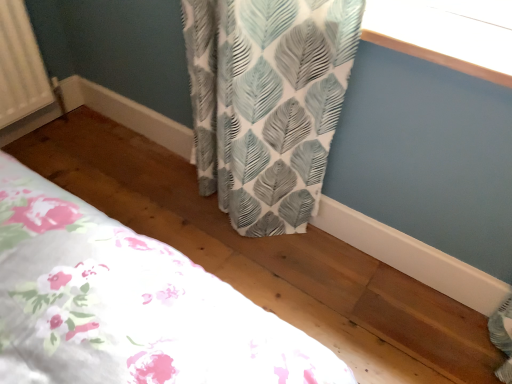
Question: From their relative heights in the image, would you say floral fabric bed at lower left is taller or shorter than white leaf-patterned curtain at upper right?

Choices:
 (A) short
 (B) tall

Answer: (B)

Question: Based on their positions, is floral fabric bed at lower left located to the left or right of white leaf-patterned curtain at upper right?

Choices:
 (A) left
 (B) right

Answer: (A)

Question: From a real-world perspective, is floral fabric bed at lower left above or below white leaf-patterned curtain at upper right?

Choices:
 (A) above
 (B) below

Answer: (B)

Question: From a real-world perspective, is white leaf-patterned curtain at upper right above or below floral fabric bed at lower left?

Choices:
 (A) below
 (B) above

Answer: (B)

Question: Is white leaf-patterned curtain at upper right to the left or to the right of floral fabric bed at lower left in the image?

Choices:
 (A) left
 (B) right

Answer: (B)

Question: In the image, is white leaf-patterned curtain at upper right positioned in front of or behind floral fabric bed at lower left?

Choices:
 (A) behind
 (B) front

Answer: (B)

Question: Considering the positions of white leaf-patterned curtain at upper right and floral fabric bed at lower left in the image, is white leaf-patterned curtain at upper right wider or thinner than floral fabric bed at lower left?

Choices:
 (A) wide
 (B) thin

Answer: (B)